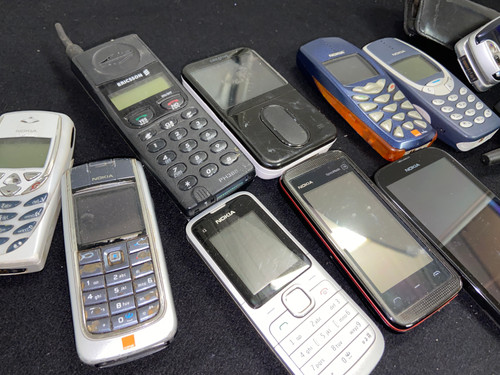
This screenshot has height=375, width=500. Find the location of `phones`. phones is located at coordinates (128, 249), (33, 196), (153, 134), (257, 108), (346, 84), (433, 75), (479, 61), (442, 176), (384, 218), (290, 261).